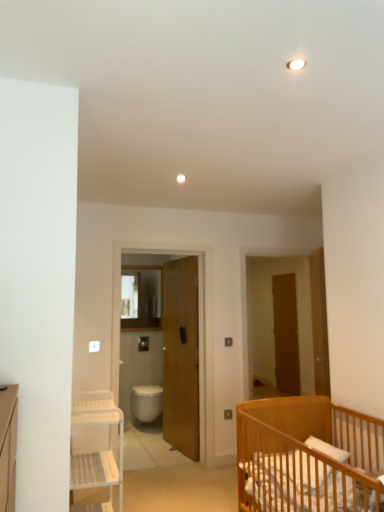
Question: Can you confirm if white glossy toilet bowl at center is shorter than white plastic shelf at left?

Choices:
 (A) yes
 (B) no

Answer: (A)

Question: From the image's perspective, does white glossy toilet bowl at center appear higher than white plastic shelf at left?

Choices:
 (A) no
 (B) yes

Answer: (A)

Question: Is white glossy toilet bowl at center with white plastic shelf at left?

Choices:
 (A) yes
 (B) no

Answer: (B)

Question: Does white glossy toilet bowl at center contain white plastic shelf at left?

Choices:
 (A) no
 (B) yes

Answer: (A)

Question: From the image's perspective, is white glossy toilet bowl at center under white plastic shelf at left?

Choices:
 (A) yes
 (B) no

Answer: (A)

Question: Does point (311, 502) appear closer or farther from the camera than point (276, 290)?

Choices:
 (A) closer
 (B) farther

Answer: (A)

Question: From the image's perspective, relative to brown wooden door at center-right, the first door when ordered from back to front, is light brown wooden crib at lower right above or below?

Choices:
 (A) below
 (B) above

Answer: (A)

Question: Looking at the image, does light brown wooden crib at lower right seem bigger or smaller compared to brown wooden door at center-right, which is the 3th door in left-to-right order?

Choices:
 (A) small
 (B) big

Answer: (B)

Question: From their relative heights in the image, would you say light brown wooden crib at lower right is taller or shorter than brown wooden door at center-right, the third door in the front-to-back sequence?

Choices:
 (A) short
 (B) tall

Answer: (A)

Question: Is light brown wooden crib at lower right wider or thinner than wooden door at center, which appears as the 3th door when viewed from the right?

Choices:
 (A) thin
 (B) wide

Answer: (B)

Question: Looking at the image, does light brown wooden crib at lower right seem bigger or smaller compared to wooden door at center, acting as the first door starting from the left?

Choices:
 (A) small
 (B) big

Answer: (B)

Question: Is light brown wooden crib at lower right inside the boundaries of wooden door at center, acting as the first door starting from the left, or outside?

Choices:
 (A) outside
 (B) inside

Answer: (A)

Question: Considering their positions, is light brown wooden crib at lower right located in front of or behind wooden door at center, marked as the 2th door in a front-to-back arrangement?

Choices:
 (A) behind
 (B) front

Answer: (B)

Question: From the image's perspective, is light brown wooden crib at lower right located above or below wooden screen door at center?

Choices:
 (A) above
 (B) below

Answer: (B)

Question: Is light brown wooden crib at lower right to the left or to the right of wooden screen door at center in the image?

Choices:
 (A) right
 (B) left

Answer: (A)